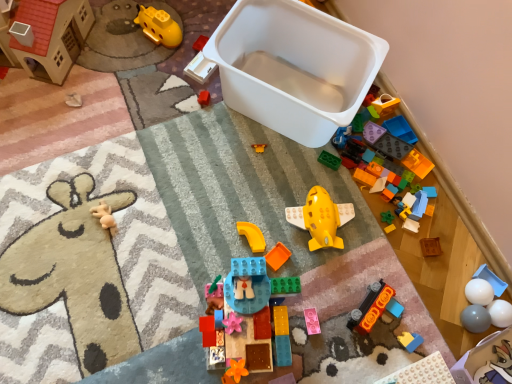
Find the location of `free area in between white plastic storage box at upper center, the 1th storage box when ordered from left to right, and pink matte block at center, the 7th toy from the left`. free area in between white plastic storage box at upper center, the 1th storage box when ordered from left to right, and pink matte block at center, the 7th toy from the left is located at coordinates (276, 198).